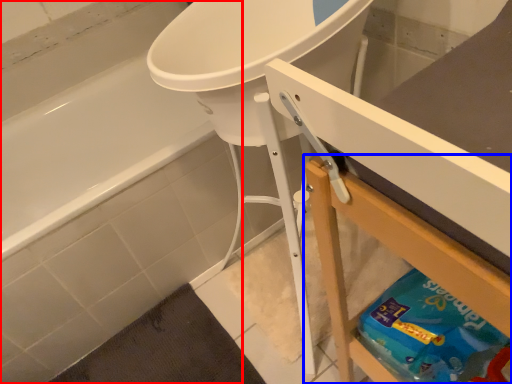
Question: Which object appears farthest to the camera in this image, bathtub (highlighted by a red box) or counter (highlighted by a blue box)?

Choices:
 (A) bathtub
 (B) counter

Answer: (A)